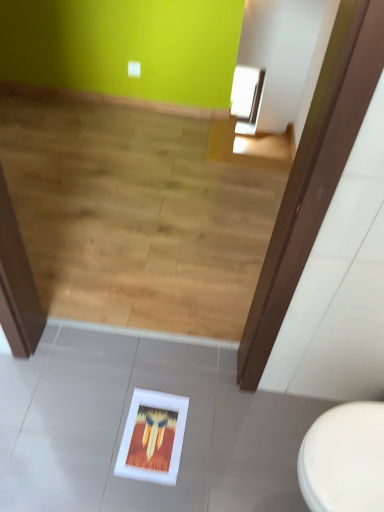
At what (x,y) coordinates should I click in order to perform the action: click on vacant area situated to the left side of white matte picture frame at lower center. Please return your answer as a coordinate pair (x, y). Looking at the image, I should click on click(84, 452).